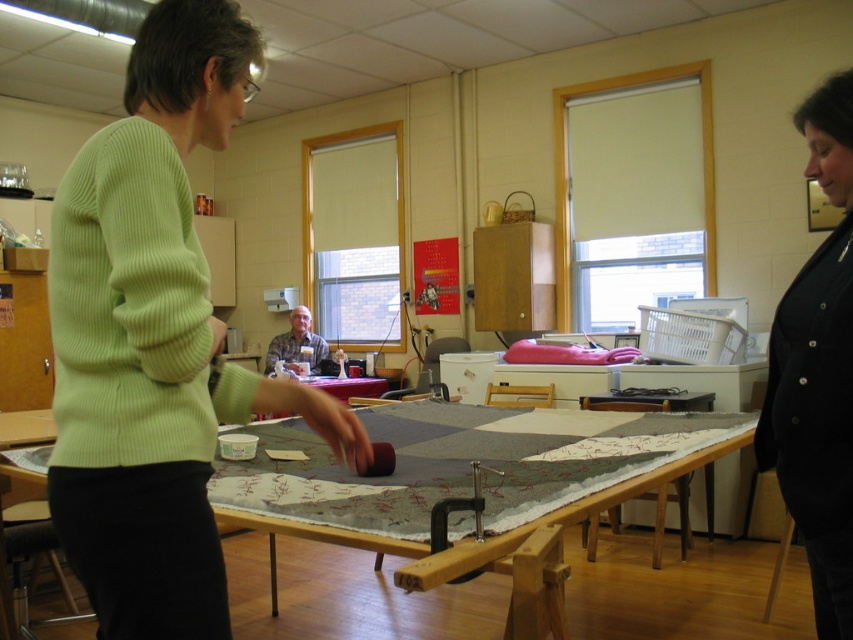
Question: Based on their relative distances, which object is nearer to the gray fabric at center?

Choices:
 (A) textured wool quilt at center
 (B) green ribbed sweater at left
 (C) wooden table at center

Answer: (A)

Question: Where is green ribbed sweater at left located in relation to textured wool quilt at center in the image?

Choices:
 (A) right
 (B) left

Answer: (B)

Question: Which of the following is the farthest from the observer?

Choices:
 (A) (833, 497)
 (B) (398, 420)
 (C) (308, 330)

Answer: (C)

Question: Is wooden table at center thinner than black buttoned jacket at right?

Choices:
 (A) yes
 (B) no

Answer: (B)

Question: Which object is positioned closest to the black buttoned jacket at right?

Choices:
 (A) green ribbed sweater at left
 (B) wooden table at center
 (C) textured wool quilt at center
 (D) gray fabric at center

Answer: (C)

Question: Can you confirm if wooden table at center is thinner than textured wool quilt at center?

Choices:
 (A) no
 (B) yes

Answer: (A)